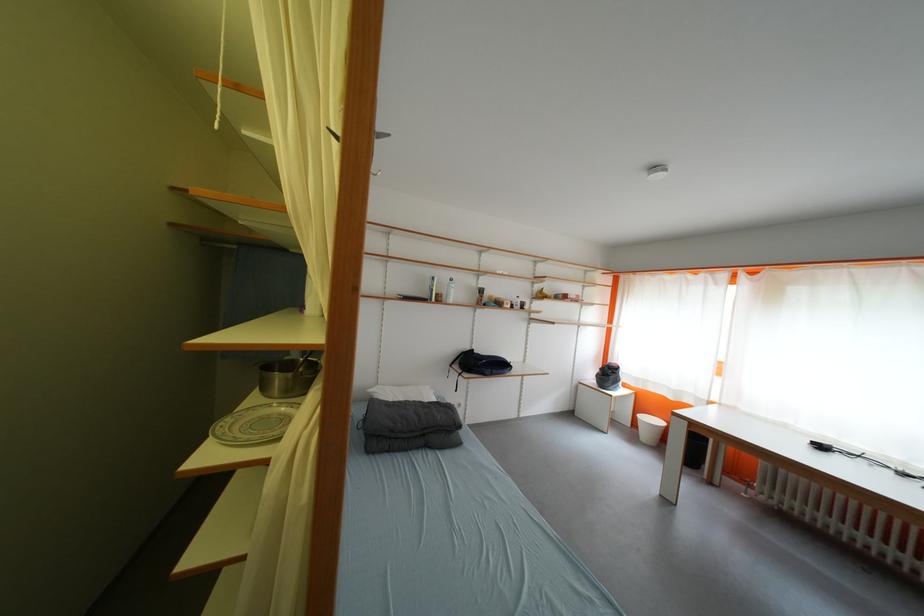
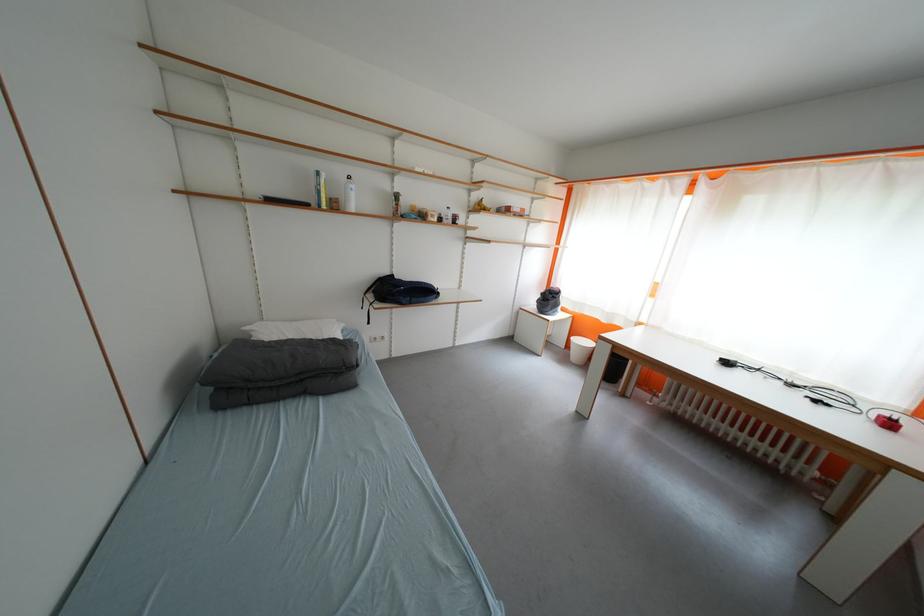
Where in the second image is the point corresponding to (x=447, y=302) from the first image?

(344, 209)